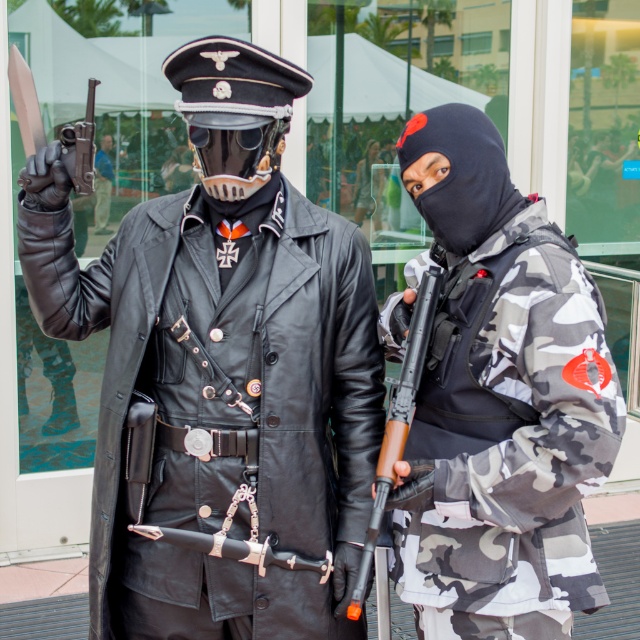
Question: Estimate the real-world distances between objects in this image. Which object is closer to the black leather coat at center?

Choices:
 (A) matte black pistol at left
 (B) camo fabric jacket at right

Answer: (B)

Question: Observing the image, what is the correct spatial positioning of camo fabric jacket at right in reference to matte black pistol at left?

Choices:
 (A) right
 (B) left

Answer: (A)

Question: Is the position of black leather coat at center less distant than that of wooden stock rifle at center?

Choices:
 (A) no
 (B) yes

Answer: (A)

Question: Which point is closer to the camera taking this photo?

Choices:
 (A) (481, 369)
 (B) (65, 148)
 (C) (381, 467)
 (D) (340, 308)

Answer: (A)

Question: Which object appears farthest from the camera in this image?

Choices:
 (A) matte black pistol at left
 (B) wooden stock rifle at center
 (C) black leather coat at center
 (D) camo fabric jacket at right

Answer: (A)

Question: Can you confirm if camo fabric jacket at right is positioned below matte black pistol at left?

Choices:
 (A) yes
 (B) no

Answer: (A)